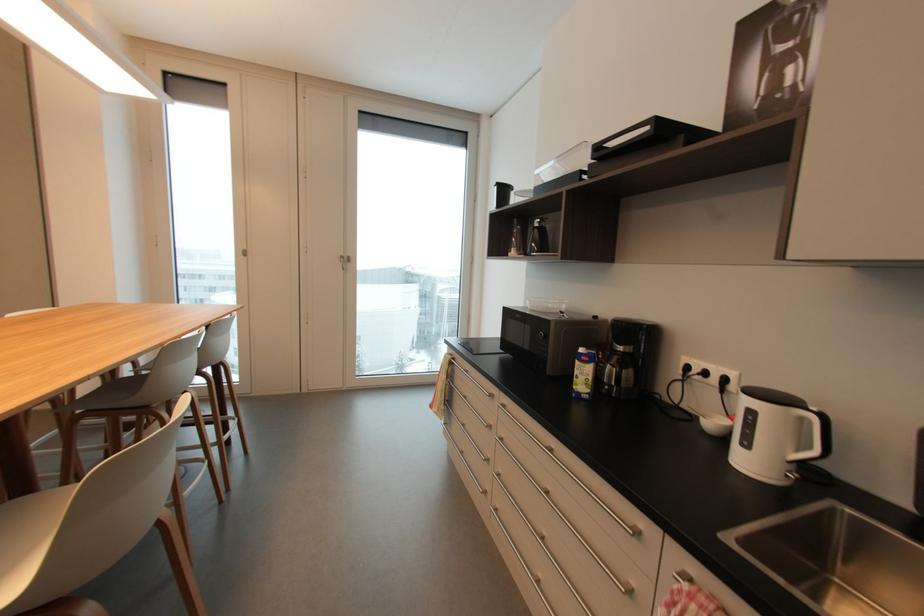
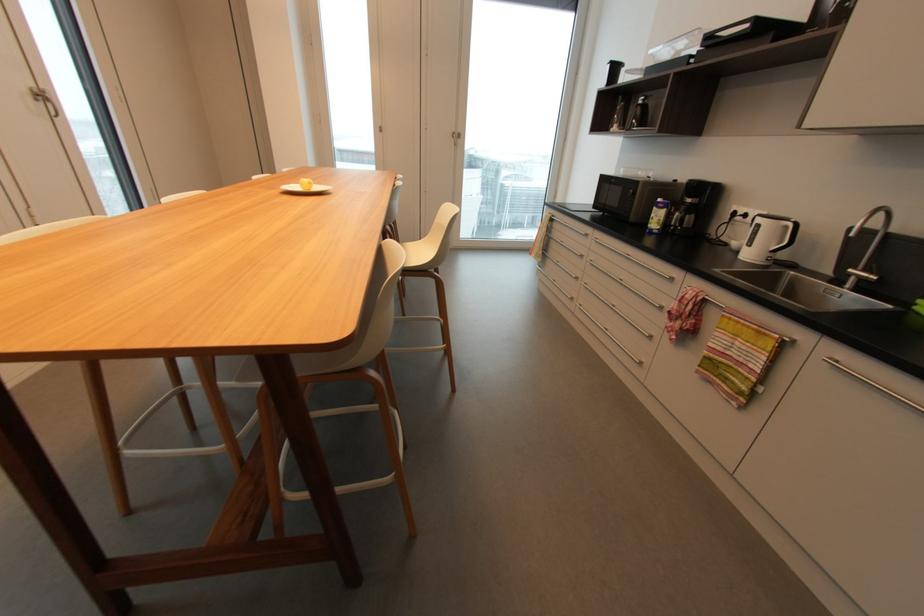
Find the pixel in the second image that matches the point at 808,419 in the first image.

(789, 227)